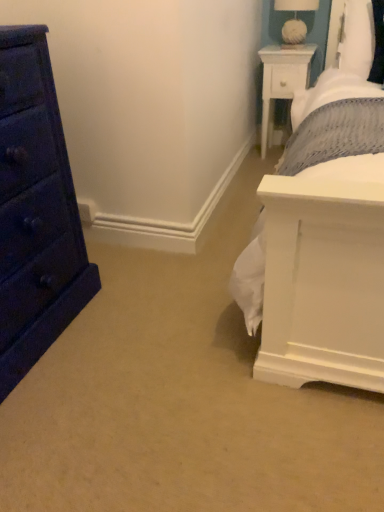
Identify the location of free space below white fabric-covered lampshade at upper right (from a real-world perspective). Image resolution: width=384 pixels, height=512 pixels. click(292, 46).